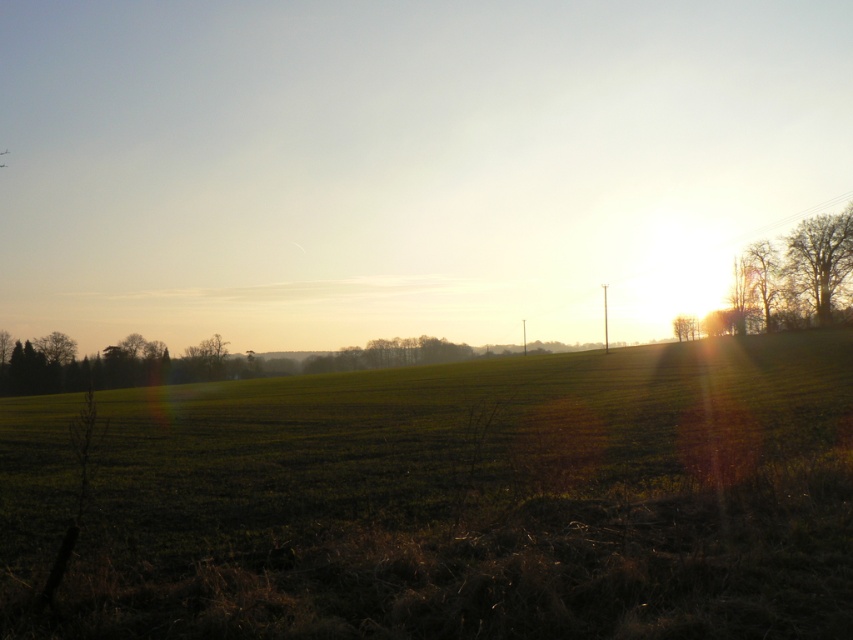
You are standing in the middle of the green grass at center and want to walk towards the bare branches at right. Which direction should you head?

A: You should head upwards because the green grass at center is below the bare branches at right.

You are a gardener planning to plant new flowers in the green grass at center and bare branches at right. Based on their sizes, which area would require more seeds to cover the same density?

The green grass at center requires more seeds because it has a larger size compared to the bare branches at right, meaning it covers a bigger area.